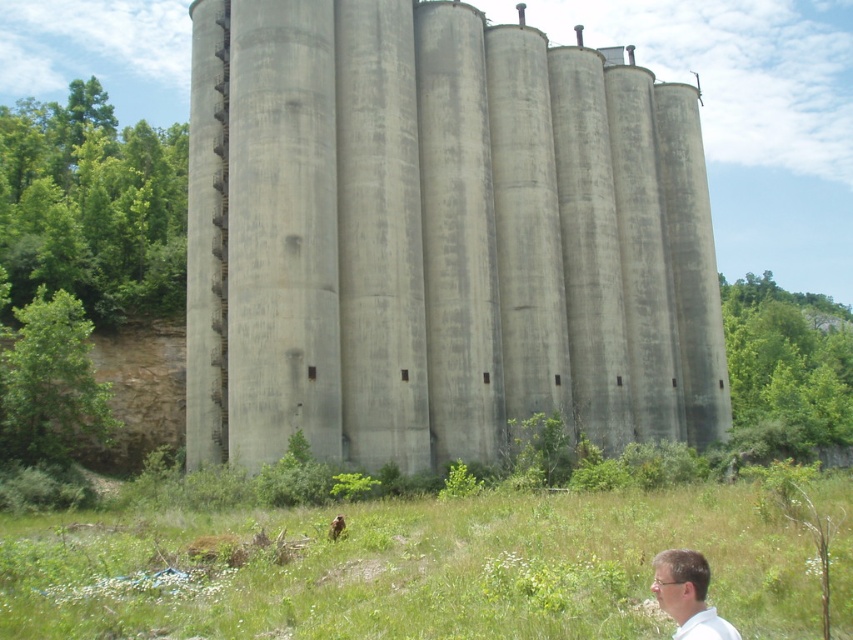
Who is more distant from viewer, (62, 628) or (701, 572)?

The point (62, 628) is behind.

This screenshot has width=853, height=640. What are the coordinates of `green grass at lower center` in the screenshot? It's located at (415, 570).

Does point (286, 435) come closer to viewer compared to point (705, 616)?

No.

Is the position of gray concrete silo at center more distant than that of white matte shirt at lower right?

Yes, gray concrete silo at center is further from the viewer.

Describe the element at coordinates (437, 237) in the screenshot. I see `gray concrete silo at center` at that location.

Locate an element on the screen. gray concrete silo at center is located at coordinates (437, 237).

Can you confirm if gray concrete silo at center is thinner than green grass at lower center?

In fact, gray concrete silo at center might be wider than green grass at lower center.

At what (x,y) coordinates should I click in order to perform the action: click on gray concrete silo at center. Please return your answer as a coordinate pair (x, y). The width and height of the screenshot is (853, 640). Looking at the image, I should click on (437, 237).